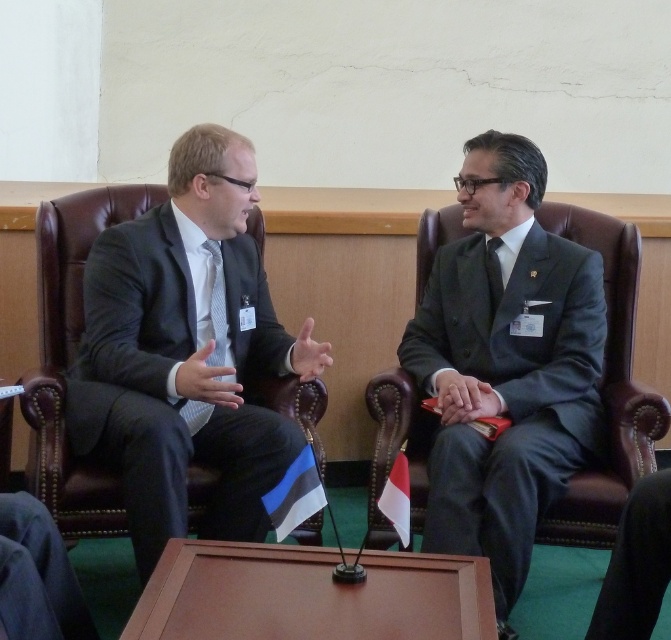
You are standing in the conference room and want to place a small plant between the two points labeled as point (168, 472) and point (285, 518). Which point should the plant be closer to in order to be placed between them?

The plant should be closer to point (285, 518) because point (168, 472) is behind point (285, 518), so placing it closer to the front point would keep it between them.

You are a photographer in a conference room. You need to take a photo of the blue and white striped flag at lower center without the gray matte suit at right blocking it. Is the flag currently visible in the scene?

The gray matte suit at right is positioned over the blue and white striped flag at lower center, so the flag is currently blocked and not visible in the scene.

You are designing a layout for a meeting room and need to ensure that the matte black suit at left and the blue and white striped flag at lower center are visible from the back of the room. Given their sizes, which object might require a more elevated position to ensure visibility?

The blue and white striped flag at lower center might require a more elevated position because it is smaller in width compared to the matte black suit at left, making it harder to see from a distance.